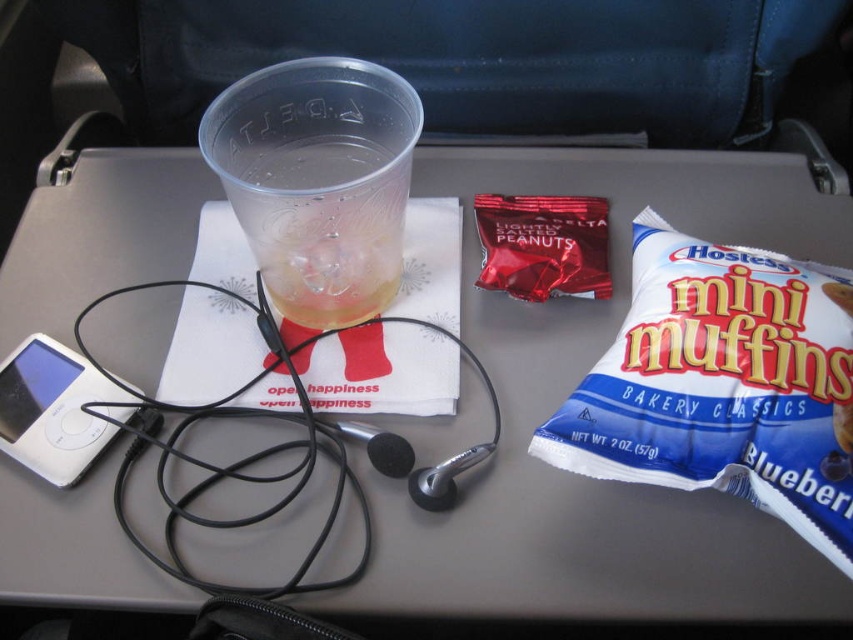
Question: Does transparent plastic cup at upper center have a lesser width compared to white plastic ipod at lower left?

Choices:
 (A) yes
 (B) no

Answer: (B)

Question: Estimate the real-world distances between objects in this image. Which object is farther from the white plastic ipod at lower left?

Choices:
 (A) blueberry paper mini muffins at upper right
 (B) transparent plastic cup at upper center

Answer: (A)

Question: Which of these objects is positioned closest to the transparent plastic cup at upper center?

Choices:
 (A) white plastic ipod at lower left
 (B) shiny red peanuts at center

Answer: (B)

Question: Is blueberry paper mini muffins at upper right below white plastic ipod at lower left?

Choices:
 (A) yes
 (B) no

Answer: (B)

Question: Considering the real-world distances, which object is closest to the blueberry paper mini muffins at upper right?

Choices:
 (A) white plastic ipod at lower left
 (B) shiny red peanuts at center

Answer: (B)

Question: Is white plastic ipod at lower left wider than shiny red peanuts at center?

Choices:
 (A) yes
 (B) no

Answer: (B)